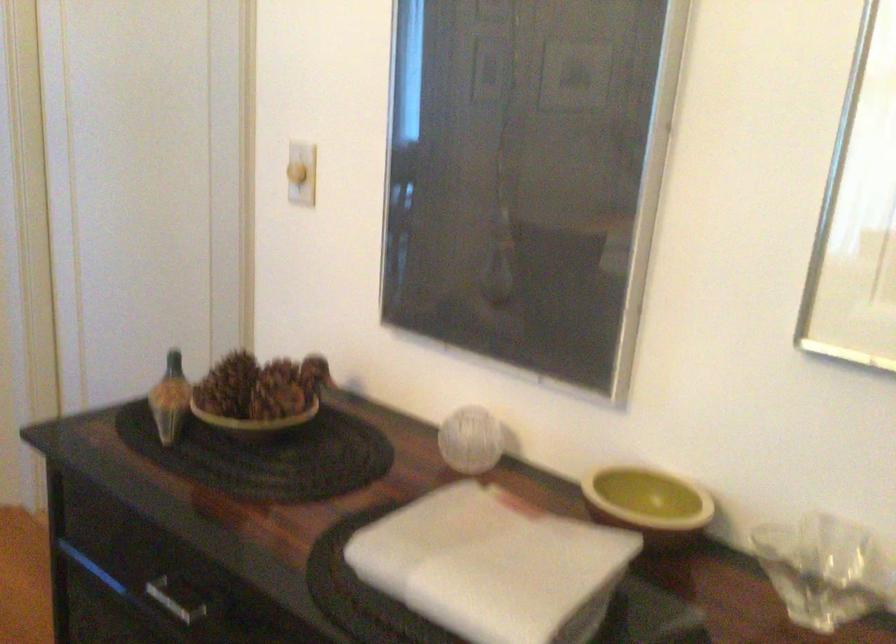
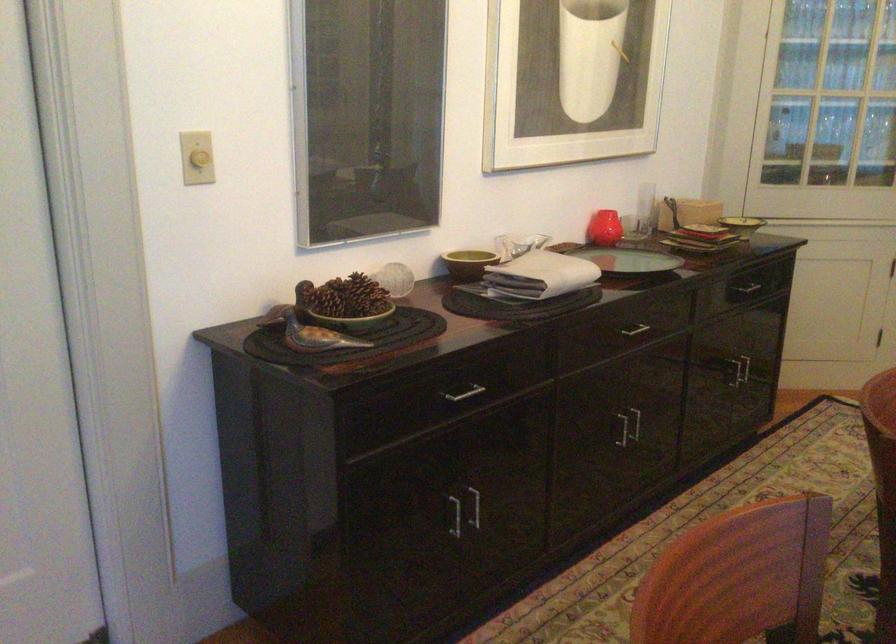
Locate, in the second image, the point that corresponds to point 179,420 in the first image.

(312, 333)